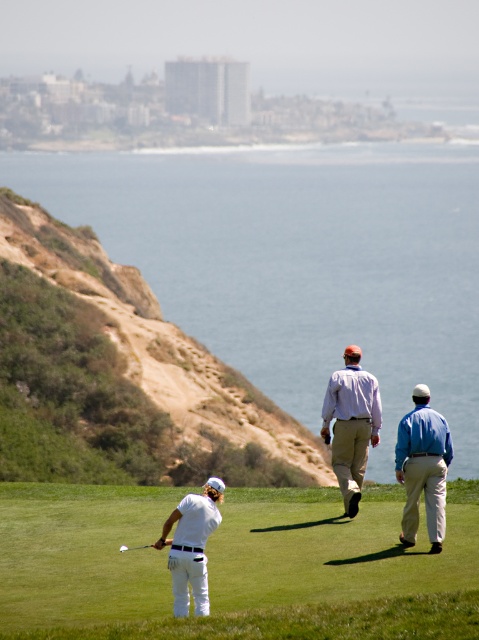
Question: Which object is positioned closest to the metallic silver golf club at lower center?

Choices:
 (A) blue cotton shirt at center
 (B) white cotton pants at lower center

Answer: (B)

Question: Can you confirm if blue cotton shirt at center is wider than metallic silver golf club at lower center?

Choices:
 (A) yes
 (B) no

Answer: (A)

Question: Which of the following is the farthest from the observer?

Choices:
 (A) blue water at center
 (B) white smooth golf club at lower center
 (C) light purple shirt at center
 (D) blue cotton shirt at center

Answer: (C)

Question: Where is white smooth golf club at lower center located in relation to white cotton pants at lower center in the image?

Choices:
 (A) above
 (B) below

Answer: (B)

Question: Can you confirm if white smooth golf club at lower center is positioned above white cotton pants at lower center?

Choices:
 (A) yes
 (B) no

Answer: (B)

Question: Among these objects, which one is nearest to the camera?

Choices:
 (A) white matte golf ball at center
 (B) light purple shirt at center

Answer: (A)